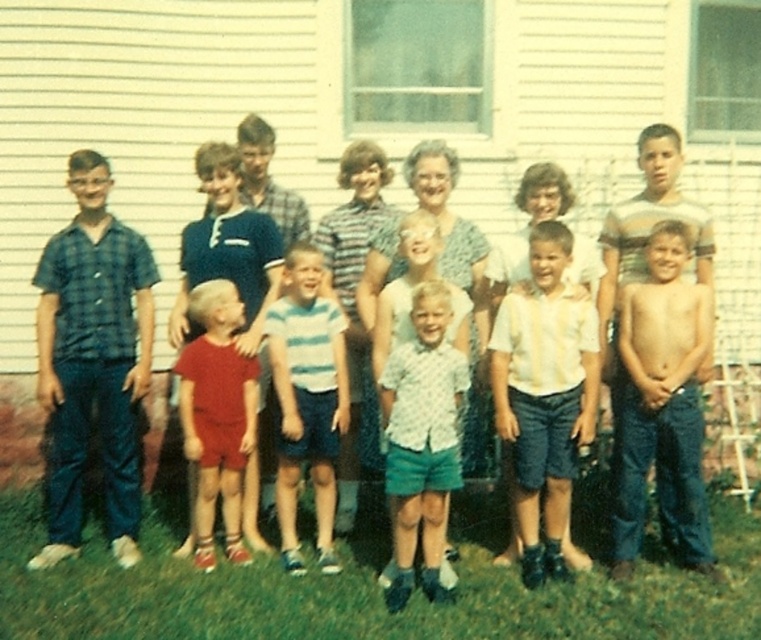
You are a photographer trying to capture a family photo. You notice the green grass at lower center and the blue jeans at right in the scene. Which object is positioned lower in the image?

The green grass at lower center is positioned below the blue jeans at right, so the green grass at lower center is lower in the image.

You are a photographer trying to capture a family photo. You notice the green grass at lower center and the red cotton shorts at center. Which object is located below the other?

The green grass at lower center is positioned under the red cotton shorts at center, so the grass is below the shorts.